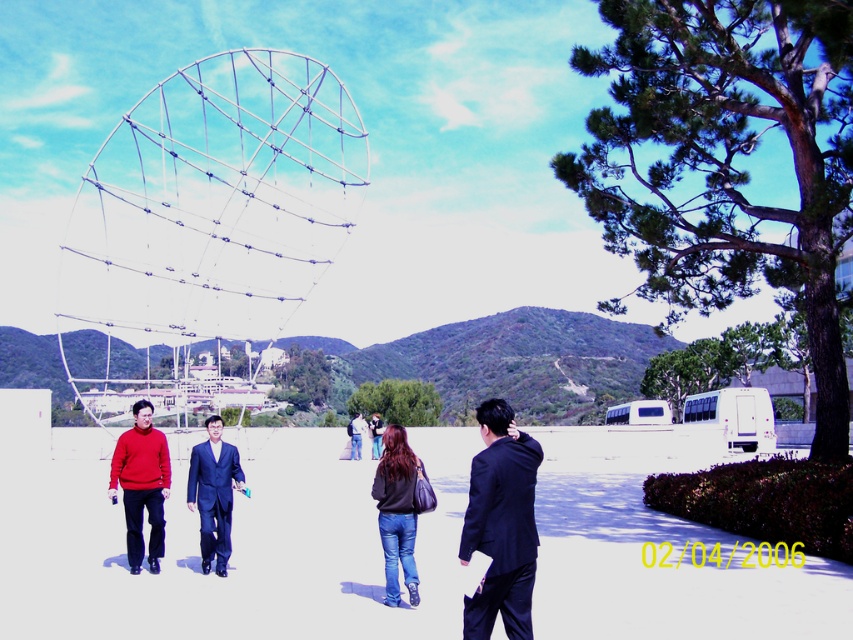
Question: Does matte red sweater at lower left appear on the left side of blue suit at center?

Choices:
 (A) yes
 (B) no

Answer: (B)

Question: Can you confirm if blue suit at center is positioned to the left of dark blue suit at center?

Choices:
 (A) yes
 (B) no

Answer: (A)

Question: Which of the following is the closest to the observer?

Choices:
 (A) black suit at center
 (B) dark blue suit at center
 (C) blue suit at center

Answer: (A)

Question: Which of the following is the farthest from the observer?

Choices:
 (A) click(x=490, y=589)
 (B) click(x=351, y=436)
 (C) click(x=225, y=538)
 (D) click(x=115, y=444)

Answer: (B)

Question: In this image, where is black suit at center located relative to matte red sweater at lower left?

Choices:
 (A) left
 (B) right

Answer: (B)

Question: Which of the following is the closest to the observer?

Choices:
 (A) (358, 449)
 (B) (134, 406)
 (C) (228, 556)
 (D) (531, 506)

Answer: (D)